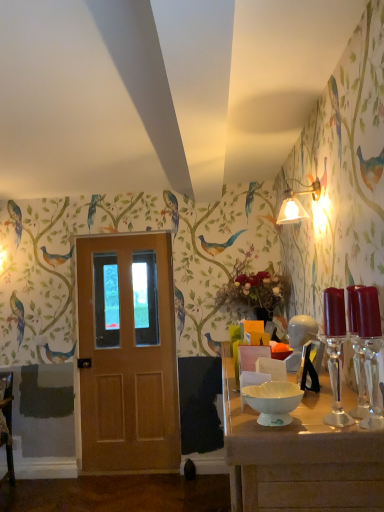
Image resolution: width=384 pixels, height=512 pixels. I want to click on white glossy table at lower right, so click(x=299, y=456).

The width and height of the screenshot is (384, 512). What do you see at coordinates (296, 204) in the screenshot?
I see `matte white lampshade at upper right` at bounding box center [296, 204].

The image size is (384, 512). I want to click on wooden door at center, so click(127, 353).

From a real-world perspective, between wooden door at center and matte white lampshade at upper right, who is vertically lower?

wooden door at center, from a real-world perspective.

From the image's perspective, would you say wooden door at center is shown under matte white lampshade at upper right?

Yes.

Based on the photo, is wooden door at center next to matte white lampshade at upper right and touching it?

No, wooden door at center is not making contact with matte white lampshade at upper right.

Can you confirm if wooden door at center is shorter than matte white lampshade at upper right?

No.

Between white glossy table at lower right and wooden door at center, which one appears on the right side from the viewer's perspective?

white glossy table at lower right.

Who is taller, white glossy table at lower right or wooden door at center?

With more height is wooden door at center.

Is white glossy table at lower right touching wooden door at center?

They are not placed beside each other.

Image resolution: width=384 pixels, height=512 pixels. What are the coordinates of `door above the white glossy table at lower right (from a real-world perspective)` in the screenshot? It's located at (127, 353).

From the image's perspective, which one is positioned lower, white glossy table at lower right or white glossy bowl at center?

From the image's view, white glossy table at lower right is below.

Would you consider white glossy table at lower right to be distant from white glossy bowl at center?

They are positioned close to each other.

Considering the sizes of white glossy table at lower right and white glossy bowl at center in the image, is white glossy table at lower right wider or thinner than white glossy bowl at center?

white glossy table at lower right is wider than white glossy bowl at center.

In the scene shown: Considering the relative sizes of white glossy table at lower right and white glossy bowl at center in the image provided, is white glossy table at lower right bigger than white glossy bowl at center?

Yes, white glossy table at lower right is bigger than white glossy bowl at center.

In terms of height, does white glossy bowl at center look taller or shorter compared to white glossy table at lower right?

Considering their sizes, white glossy bowl at center has less height than white glossy table at lower right.

Consider the image. Is white glossy bowl at center thinner than white glossy table at lower right?

Yes.

This screenshot has height=512, width=384. I want to click on table in front of the white glossy bowl at center, so [x=299, y=456].

Does white glossy bowl at center come in front of matte white lampshade at upper right?

Yes, the depth of white glossy bowl at center is less than that of matte white lampshade at upper right.

Which object is thinner, white glossy bowl at center or matte white lampshade at upper right?

With smaller width is matte white lampshade at upper right.

What's the angular difference between white glossy bowl at center and matte white lampshade at upper right's facing directions?

The angle between the facing direction of white glossy bowl at center and the facing direction of matte white lampshade at upper right is 1.75 degrees.

Is white glossy bowl at center not close to matte white lampshade at upper right?

Yes, white glossy bowl at center is far from matte white lampshade at upper right.

Which is closer to the camera, (90, 351) or (239, 484)?

The point (239, 484) is closer to the camera.

Is white glossy table at lower right a part of wooden door at center?

That's incorrect, white glossy table at lower right is not inside wooden door at center.

Looking at their sizes, would you say wooden door at center is wider or thinner than white glossy table at lower right?

wooden door at center is thinner than white glossy table at lower right.

Is wooden door at center looking in the opposite direction of white glossy table at lower right?

wooden door at center does not have its back to white glossy table at lower right.

Is matte white lampshade at upper right with white glossy bowl at center?

No, matte white lampshade at upper right is not in contact with white glossy bowl at center.

Which object is closer to the camera, matte white lampshade at upper right or white glossy bowl at center?

white glossy bowl at center.

From a real-world perspective, who is located lower, matte white lampshade at upper right or white glossy bowl at center?

white glossy bowl at center is physically lower.

Looking at this image, from the image's perspective, is matte white lampshade at upper right beneath white glossy bowl at center?

Incorrect, from the image's perspective, matte white lampshade at upper right is higher than white glossy bowl at center.

Image resolution: width=384 pixels, height=512 pixels. What are the coordinates of `door below the matte white lampshade at upper right (from the image's perspective)` in the screenshot? It's located at (127, 353).

This screenshot has height=512, width=384. In order to click on table below the wooden door at center (from a real-world perspective) in this screenshot , I will do `click(299, 456)`.

From the image, which object appears to be nearer to white glossy bowl at center, matte white lampshade at upper right or white glossy table at lower right?

white glossy table at lower right lies closer to white glossy bowl at center than the other object.

In the scene shown: Based on their spatial positions, is white glossy table at lower right or white glossy bowl at center closer to wooden door at center?

white glossy table at lower right is closer to wooden door at center.

Based on their spatial positions, is matte white lampshade at upper right or white glossy bowl at center further from white glossy table at lower right?

matte white lampshade at upper right is further to white glossy table at lower right.

Which object lies nearer to the anchor point matte white lampshade at upper right, white glossy table at lower right or wooden door at center?

wooden door at center is positioned closer to the anchor matte white lampshade at upper right.

When comparing their distances from matte white lampshade at upper right, does white glossy bowl at center or wooden door at center seem closer?

wooden door at center.

Looking at the image, which one is located further to white glossy bowl at center, matte white lampshade at upper right or wooden door at center?

wooden door at center is positioned further to the anchor white glossy bowl at center.

Which object lies nearer to the anchor point white glossy bowl at center, wooden door at center or matte white lampshade at upper right?

matte white lampshade at upper right is closer to white glossy bowl at center.

Which object lies further to the anchor point wooden door at center, matte white lampshade at upper right or white glossy bowl at center?

white glossy bowl at center is positioned further to the anchor wooden door at center.

In order to click on bowl between white glossy table at lower right and wooden door at center along the z-axis in this screenshot , I will do `click(273, 401)`.

At what (x,y) coordinates should I click in order to perform the action: click on bowl between matte white lampshade at upper right and white glossy table at lower right from top to bottom. Please return your answer as a coordinate pair (x, y). The height and width of the screenshot is (512, 384). Looking at the image, I should click on (273, 401).

Identify the location of light fixture between white glossy table at lower right and wooden door at center in the front-back direction. (296, 204).

The width and height of the screenshot is (384, 512). I want to click on light fixture located between white glossy bowl at center and wooden door at center in the depth direction, so click(296, 204).